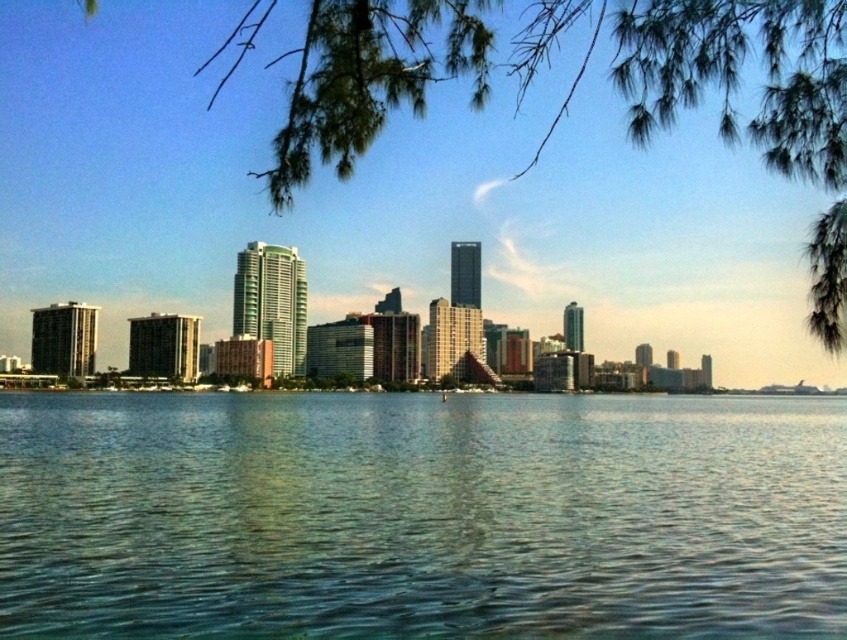
Question: Considering the relative positions of clear blue water at center and green leafy tree at upper center in the image provided, where is clear blue water at center located with respect to green leafy tree at upper center?

Choices:
 (A) above
 (B) below

Answer: (B)

Question: Which of the following is the closest to the observer?

Choices:
 (A) green leafy tree at upper center
 (B) clear blue water at center

Answer: (A)

Question: Which of the following is the farthest from the observer?

Choices:
 (A) green leafy tree at upper center
 (B) clear blue water at center

Answer: (B)

Question: Can you confirm if clear blue water at center is positioned to the right of green leafy tree at upper center?

Choices:
 (A) no
 (B) yes

Answer: (A)

Question: Is clear blue water at center below green leafy tree at upper center?

Choices:
 (A) yes
 (B) no

Answer: (A)

Question: Which of the following is the closest to the observer?

Choices:
 (A) (756, 461)
 (B) (840, 44)

Answer: (B)